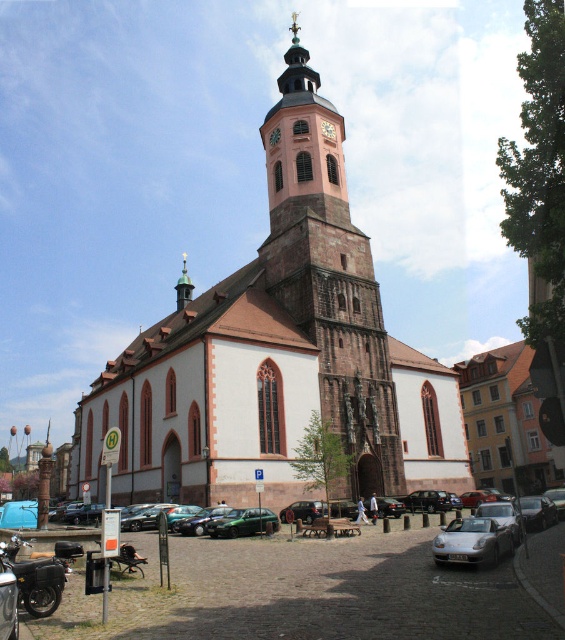
You are standing in the town square looking at the historic church. There are two points marked on the church facade. The first point is located at coordinates point (497,525) and the second at point (249,509). Which point is closer to your current position?

Point (497,525) is closer to the camera than point (249,509), so the first point is closer to your position.